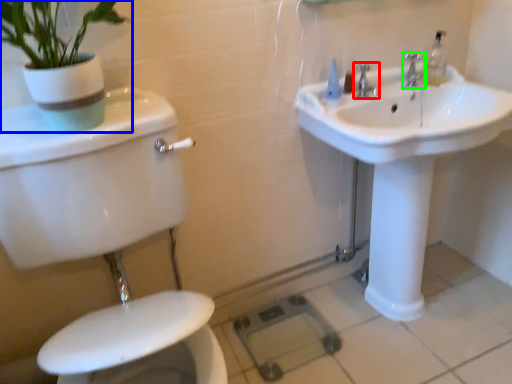
Question: Which object is the farthest from tap (highlighted by a red box)? Choose among these: houseplant (highlighted by a blue box) or tap (highlighted by a green box).

Choices:
 (A) houseplant
 (B) tap

Answer: (A)